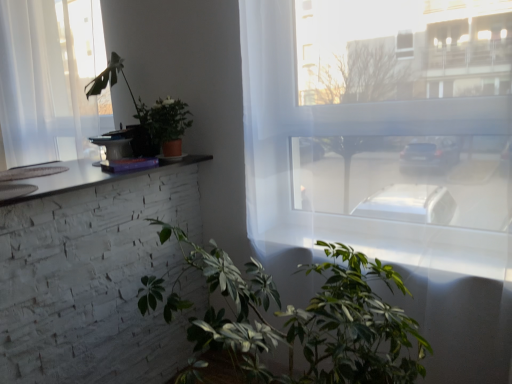
Question: From a real-world perspective, relative to green matte plant at lower center, positioned as the third houseplant in top-to-bottom order, is green matte plant at upper left, which is the 1th houseplant from top to bottom, vertically above or below?

Choices:
 (A) below
 (B) above

Answer: (B)

Question: In terms of size, does green matte plant at upper left, which is counted as the 3th houseplant, starting from the bottom, appear bigger or smaller than green matte plant at lower center, positioned as the third houseplant in top-to-bottom order?

Choices:
 (A) small
 (B) big

Answer: (A)

Question: Which of these objects is positioned closest to the matte brown pot at upper center, the second houseplant when ordered from top to bottom?

Choices:
 (A) transparent glass window at center, which appears as the second window when viewed from the back
 (B) green matte plant at lower center, positioned as the first houseplant in bottom-to-top order
 (C) green matte plant at upper left, which is counted as the 3th houseplant, starting from the bottom
 (D) clear glass window at upper left, the second window from the right

Answer: (C)

Question: Based on their relative distances, which object is nearer to the green matte plant at lower center, positioned as the first houseplant in bottom-to-top order?

Choices:
 (A) transparent glass window at center, arranged as the 2th window when viewed from the left
 (B) clear glass window at upper left, the second window from the right
 (C) matte brown pot at upper center, the 2th houseplant in the bottom-to-top sequence
 (D) green matte plant at upper left, which is counted as the 3th houseplant, starting from the bottom

Answer: (A)